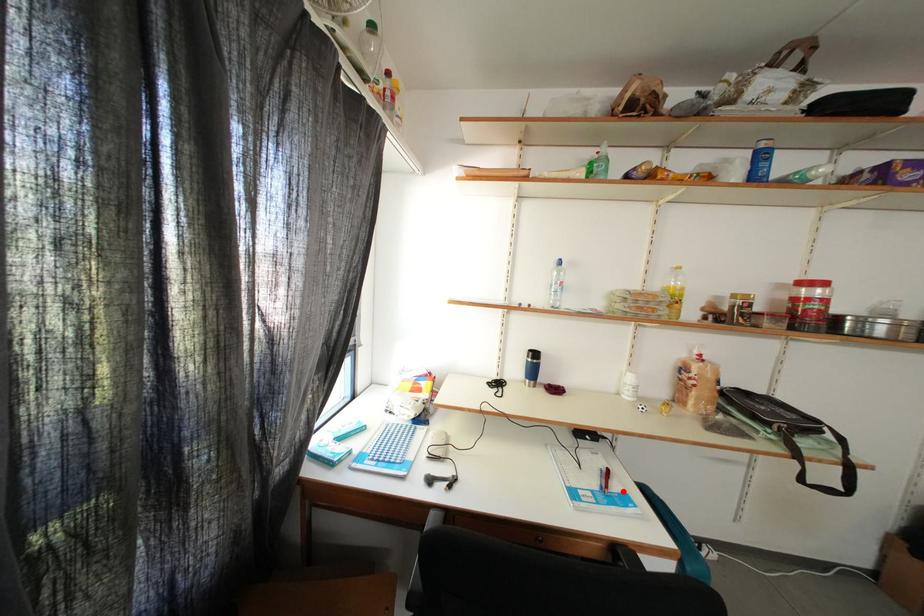
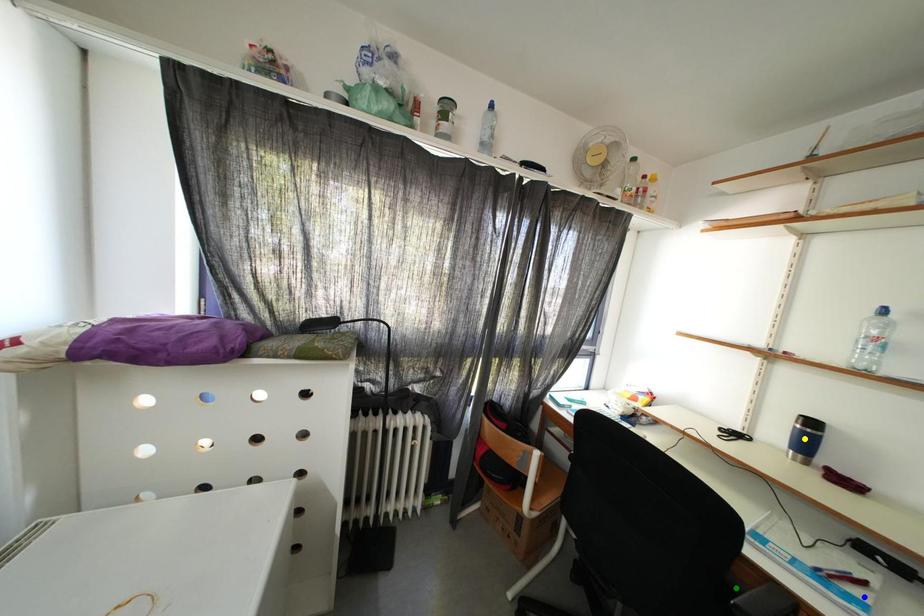
Question: I am providing you with two images of the same scene from different viewpoints. A red point is marked on the first image. You are given multiple points on the second image. Which spot in image 2 lines up with the point in image 1?

Choices:
 (A) green point
 (B) blue point
 (C) yellow point

Answer: (B)